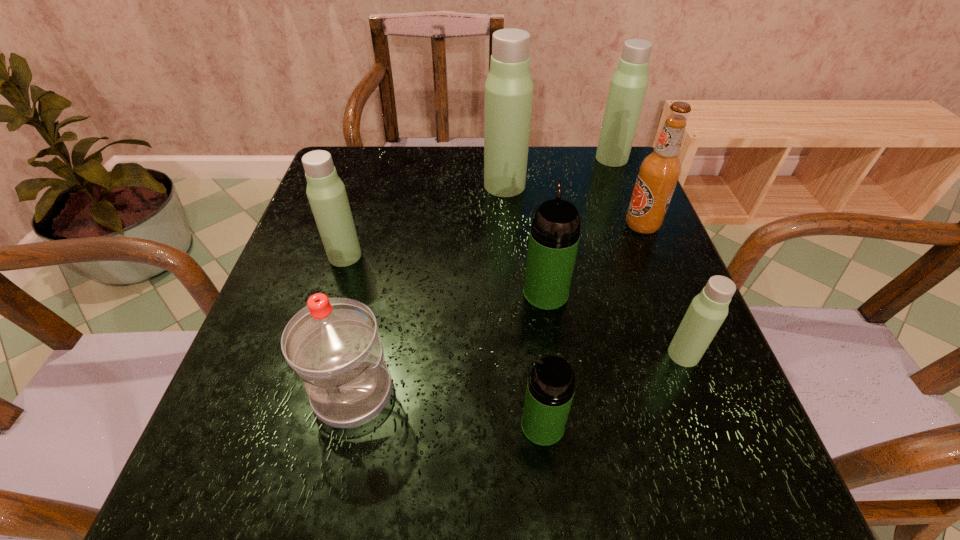
Identify which light thermos bottle is the third nearest to the farthest thermos bottle. Please provide its 2D coordinates. Your answer should be formatted as a tuple, i.e. [(x, y)], where the tuple contains the x and y coordinates of a point satisfying the conditions above.

[(326, 193)]

Locate an element on the screen. This screenshot has height=540, width=960. light thermos bottle that is the third nearest to the nearer green thermos bottle is located at coordinates (509, 87).

This screenshot has width=960, height=540. What are the coordinates of `vacant space that satisfies the following two spatial constraints: 1. on the back side of the farthest thermos bottle; 2. on the right side of the seventh nearest object` in the screenshot? It's located at [x=503, y=158].

I want to click on free point that satisfies the following two spatial constraints: 1. from the spout of the fourth farthest thermos bottle; 2. on the right side of the fifth shortest thermos bottle, so click(x=527, y=158).

Locate an element on the screen. The image size is (960, 540). vacant space that satisfies the following two spatial constraints: 1. on the back side of the tallest thermos bottle; 2. on the left side of the fourth nearest thermos bottle is located at coordinates (367, 185).

This screenshot has height=540, width=960. Identify the location of vacant space that satisfies the following two spatial constraints: 1. on the front label of the beer bottle; 2. on the handle side of the white water bottle. (708, 393).

This screenshot has width=960, height=540. I want to click on free spot that satisfies the following two spatial constraints: 1. on the front side of the second nearest thermos bottle; 2. on the right side of the leftmost thermos bottle, so point(314,354).